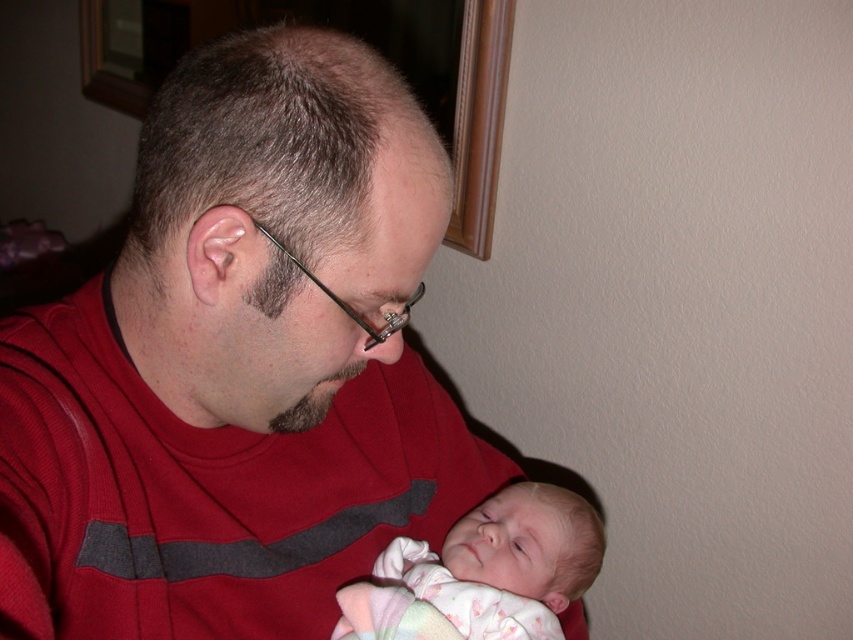
Does matte red shirt at center have a smaller size compared to soft pink fabric at center?

No, matte red shirt at center is not smaller than soft pink fabric at center.

Who is lower down, matte red shirt at center or soft pink fabric at center?

soft pink fabric at center is below.

This screenshot has width=853, height=640. What do you see at coordinates (238, 364) in the screenshot?
I see `matte red shirt at center` at bounding box center [238, 364].

Find the location of `matte red shirt at center`. matte red shirt at center is located at coordinates (238, 364).